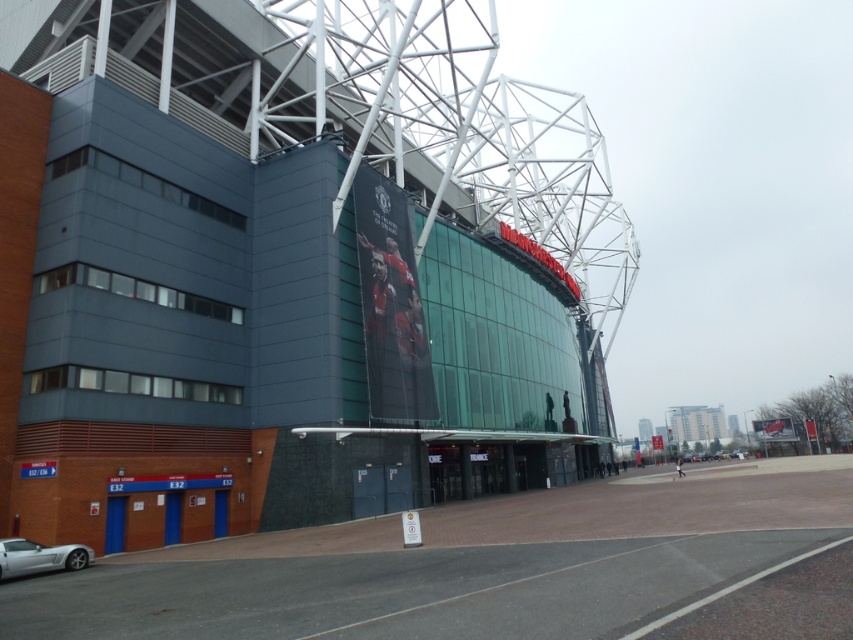
Who is more distant from viewer, [456,260] or [71,557]?

The point [456,260] is behind.

Looking at this image, does dark gray concrete stadium at center have a larger size compared to silver metallic car at lower left?

Yes, dark gray concrete stadium at center is bigger than silver metallic car at lower left.

The image size is (853, 640). Identify the location of dark gray concrete stadium at center. (291, 266).